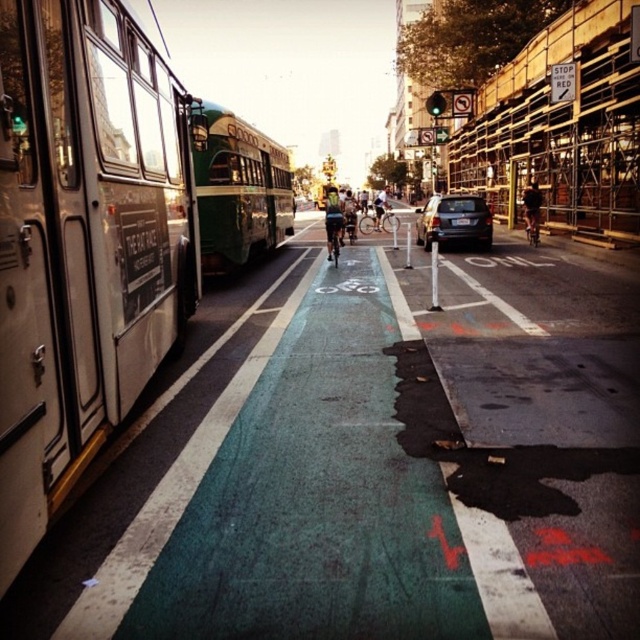
Question: Can you confirm if green matte bus at center is positioned below matte black bicycle at center?

Choices:
 (A) yes
 (B) no

Answer: (A)

Question: Is metallic silver bus at left further to the viewer compared to matte black bicycle at center?

Choices:
 (A) yes
 (B) no

Answer: (B)

Question: Which point is closer to the camera taking this photo?

Choices:
 (A) (532, 186)
 (B) (236, 184)

Answer: (B)

Question: Does matte black suv at center appear on the right side of green fabric bicycle at center?

Choices:
 (A) yes
 (B) no

Answer: (B)

Question: Estimate the real-world distances between objects in this image. Which object is closer to the matte black suv at center?

Choices:
 (A) dark blue jeans at center
 (B) green fabric bicycle at center
 (C) matte black bicycle at center

Answer: (A)

Question: Which of the following is the farthest from the observer?

Choices:
 (A) green fabric bicycle at center
 (B) reflective silver bicycle at center

Answer: (A)